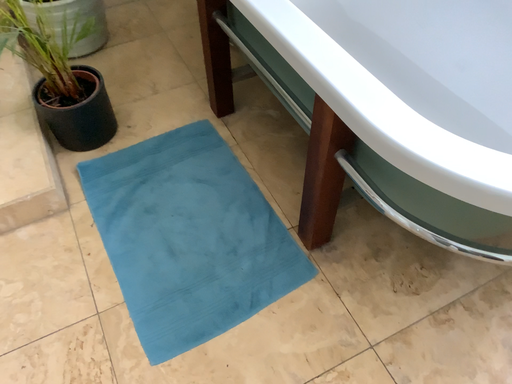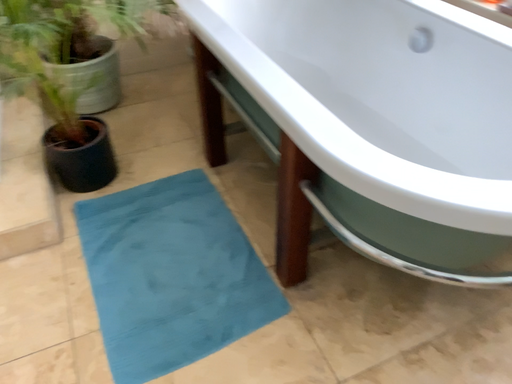
Question: Which way did the camera rotate in the video?

Choices:
 (A) rotated upward
 (B) rotated downward

Answer: (A)